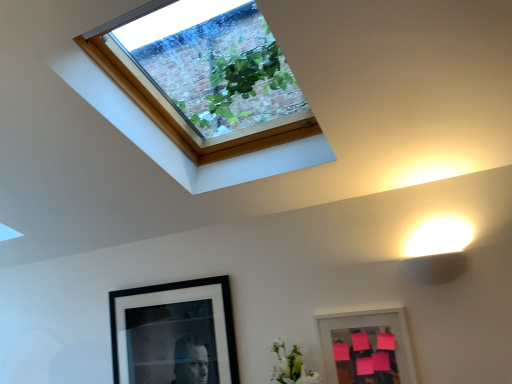
Consider the image. Measure the distance between white matte flower at lower center and camera.

A distance of 1.91 meters exists between white matte flower at lower center and camera.

At what (x,y) coordinates should I click in order to perform the action: click on white matte flower at lower center. Please return your answer as a coordinate pair (x, y). The width and height of the screenshot is (512, 384). Looking at the image, I should click on (291, 366).

Are clear glass window at upper center and black matte picture frame at lower left, the second picture frame in the front-to-back sequence, beside each other?

clear glass window at upper center is not next to black matte picture frame at lower left, the second picture frame in the front-to-back sequence, and they're not touching.

Can you confirm if clear glass window at upper center is positioned to the left of black matte picture frame at lower left, which is the 1th picture frame in back-to-front order?

In fact, clear glass window at upper center is to the right of black matte picture frame at lower left, which is the 1th picture frame in back-to-front order.

How many degrees apart are the facing directions of clear glass window at upper center and black matte picture frame at lower left, which is the 1th picture frame in back-to-front order?

There is a 0.576-degree angle between the facing directions of clear glass window at upper center and black matte picture frame at lower left, which is the 1th picture frame in back-to-front order.

Locate an element on the screen. picture frame on the left of clear glass window at upper center is located at coordinates (174, 333).

Between black matte picture frame at lower left, which is the second picture frame from right to left, and pink matte picture frame at lower right, which is the second picture frame in left-to-right order, which one is positioned behind?

black matte picture frame at lower left, which is the second picture frame from right to left, is further away from the camera.

Is black matte picture frame at lower left, the first picture frame when ordered from left to right, positioned far away from pink matte picture frame at lower right, the 1th picture frame when ordered from front to back?

They are positioned close to each other.

From the image's perspective, is black matte picture frame at lower left, the first picture frame when ordered from left to right, on pink matte picture frame at lower right, which is the second picture frame in left-to-right order?

No, from the image's perspective, black matte picture frame at lower left, the first picture frame when ordered from left to right, is not on top of pink matte picture frame at lower right, which is the second picture frame in left-to-right order.

Is black matte picture frame at lower left, the first picture frame when ordered from left to right, inside or outside of pink matte picture frame at lower right, the second picture frame viewed from the back?

black matte picture frame at lower left, the first picture frame when ordered from left to right, is not inside pink matte picture frame at lower right, the second picture frame viewed from the back, it's outside.

Is white matte flower at lower center oriented towards pink matte picture frame at lower right, which is the second picture frame in left-to-right order?

No, white matte flower at lower center does not turn towards pink matte picture frame at lower right, which is the second picture frame in left-to-right order.

Is white matte flower at lower center directly adjacent to pink matte picture frame at lower right, the second picture frame viewed from the back?

There is a gap between white matte flower at lower center and pink matte picture frame at lower right, the second picture frame viewed from the back.

Which is closer, (281, 366) or (365, 314)?

The point (281, 366) is closer.

From a real-world perspective, who is located higher, white matte flower at lower center or pink matte picture frame at lower right, the second picture frame viewed from the back?

white matte flower at lower center.

Which of these two, black matte picture frame at lower left, which is the 1th picture frame in back-to-front order, or white matte flower at lower center, is thinner?

Thinner between the two is black matte picture frame at lower left, which is the 1th picture frame in back-to-front order.

How distant is black matte picture frame at lower left, the second picture frame in the front-to-back sequence, from white matte flower at lower center?

black matte picture frame at lower left, the second picture frame in the front-to-back sequence, is 22.03 inches from white matte flower at lower center.

Is black matte picture frame at lower left, the first picture frame when ordered from left to right, positioned far away from white matte flower at lower center?

Actually, black matte picture frame at lower left, the first picture frame when ordered from left to right, and white matte flower at lower center are a little close together.

At what (x,y) coordinates should I click in order to perform the action: click on picture frame that is above the white matte flower at lower center (from a real-world perspective). Please return your answer as a coordinate pair (x, y). The height and width of the screenshot is (384, 512). Looking at the image, I should click on (174, 333).

From a real-world perspective, is black matte picture frame at lower left, the second picture frame in the front-to-back sequence, positioned under clear glass window at upper center based on gravity?

Yes, from a real-world perspective, black matte picture frame at lower left, the second picture frame in the front-to-back sequence, is below clear glass window at upper center.

Does point (205, 368) lie in front of point (207, 85)?

Yes, it is in front of point (207, 85).

Does black matte picture frame at lower left, the first picture frame when ordered from left to right, appear on the left side of clear glass window at upper center?

Yes.

From the image's perspective, between black matte picture frame at lower left, which is the second picture frame from right to left, and clear glass window at upper center, who is located below?

black matte picture frame at lower left, which is the second picture frame from right to left, is shown below in the image.

Considering the relative sizes of clear glass window at upper center and pink matte picture frame at lower right, the 1th picture frame when ordered from right to left, in the image provided, is clear glass window at upper center thinner than pink matte picture frame at lower right, the 1th picture frame when ordered from right to left,?

In fact, clear glass window at upper center might be wider than pink matte picture frame at lower right, the 1th picture frame when ordered from right to left.

Is point (278, 50) positioned behind point (324, 367)?

No.

Locate an element on the screen. This screenshot has width=512, height=384. window in front of the pink matte picture frame at lower right, the 1th picture frame when ordered from front to back is located at coordinates (203, 74).

How distant is clear glass window at upper center from white matte flower at lower center?

They are 2.42 meters apart.

Is clear glass window at upper center taller than white matte flower at lower center?

Correct, clear glass window at upper center is much taller as white matte flower at lower center.

Are clear glass window at upper center and white matte flower at lower center far apart?

Yes, clear glass window at upper center is far from white matte flower at lower center.

Which point is more forward, (232, 68) or (297, 355)?

Point (232, 68)

You are a GUI agent. You are given a task and a screenshot of the screen. Output one action in this format:
    pyautogui.click(x=<x>, y=<y>)
    Task: Click on the window above the black matte picture frame at lower left, which is the second picture frame from right to left (from a real-world perspective)
    This screenshot has width=512, height=384.
    Given the screenshot: What is the action you would take?
    pyautogui.click(x=203, y=74)

Find the location of a particular element. This screenshot has height=384, width=512. picture frame to the right of black matte picture frame at lower left, which is the second picture frame from right to left is located at coordinates [365, 325].

When comparing their distances from black matte picture frame at lower left, the second picture frame in the front-to-back sequence, does pink matte picture frame at lower right, the 1th picture frame when ordered from front to back, or white matte flower at lower center seem closer?

Based on the image, white matte flower at lower center appears to be nearer to black matte picture frame at lower left, the second picture frame in the front-to-back sequence.

Looking at the image, which one is located further to pink matte picture frame at lower right, the 1th picture frame when ordered from front to back, white matte flower at lower center or black matte picture frame at lower left, which is the 1th picture frame in back-to-front order?

Based on the image, black matte picture frame at lower left, which is the 1th picture frame in back-to-front order, appears to be further to pink matte picture frame at lower right, the 1th picture frame when ordered from front to back.

When comparing their distances from pink matte picture frame at lower right, which is the second picture frame in left-to-right order, does clear glass window at upper center or white matte flower at lower center seem further?

clear glass window at upper center lies further to pink matte picture frame at lower right, which is the second picture frame in left-to-right order, than the other object.

Which object lies further to the anchor point clear glass window at upper center, black matte picture frame at lower left, the first picture frame when ordered from left to right, or pink matte picture frame at lower right, the 1th picture frame when ordered from right to left?

pink matte picture frame at lower right, the 1th picture frame when ordered from right to left, is further to clear glass window at upper center.

Which object lies further to the anchor point clear glass window at upper center, white matte flower at lower center or pink matte picture frame at lower right, which is the second picture frame in left-to-right order?

white matte flower at lower center.

From the image, which object appears to be farther from pink matte picture frame at lower right, the 1th picture frame when ordered from front to back, white matte flower at lower center or clear glass window at upper center?

Among the two, clear glass window at upper center is located further to pink matte picture frame at lower right, the 1th picture frame when ordered from front to back.

Which object lies further to the anchor point pink matte picture frame at lower right, which is the second picture frame in left-to-right order, black matte picture frame at lower left, the second picture frame in the front-to-back sequence, or clear glass window at upper center?

clear glass window at upper center is further to pink matte picture frame at lower right, which is the second picture frame in left-to-right order.

When comparing their distances from black matte picture frame at lower left, the second picture frame in the front-to-back sequence, does pink matte picture frame at lower right, the 1th picture frame when ordered from front to back, or clear glass window at upper center seem further?

Among the two, clear glass window at upper center is located further to black matte picture frame at lower left, the second picture frame in the front-to-back sequence.

You are a GUI agent. You are given a task and a screenshot of the screen. Output one action in this format:
    pyautogui.click(x=<x>, y=<y>)
    Task: Click on the picture frame that lies between clear glass window at upper center and black matte picture frame at lower left, which is the second picture frame from right to left, from top to bottom
    
    Given the screenshot: What is the action you would take?
    pyautogui.click(x=365, y=325)

You are a GUI agent. You are given a task and a screenshot of the screen. Output one action in this format:
    pyautogui.click(x=<x>, y=<y>)
    Task: Click on the flower that lies between clear glass window at upper center and black matte picture frame at lower left, which is the second picture frame from right to left, from top to bottom
    
    Given the screenshot: What is the action you would take?
    pyautogui.click(x=291, y=366)

Where is `flower between black matte picture frame at lower left, the second picture frame in the front-to-back sequence, and pink matte picture frame at lower right, the 1th picture frame when ordered from right to left, in the horizontal direction`? flower between black matte picture frame at lower left, the second picture frame in the front-to-back sequence, and pink matte picture frame at lower right, the 1th picture frame when ordered from right to left, in the horizontal direction is located at coordinates (291, 366).

At what (x,y) coordinates should I click in order to perform the action: click on picture frame between clear glass window at upper center and white matte flower at lower center vertically. Please return your answer as a coordinate pair (x, y). Image resolution: width=512 pixels, height=384 pixels. Looking at the image, I should click on point(365,325).